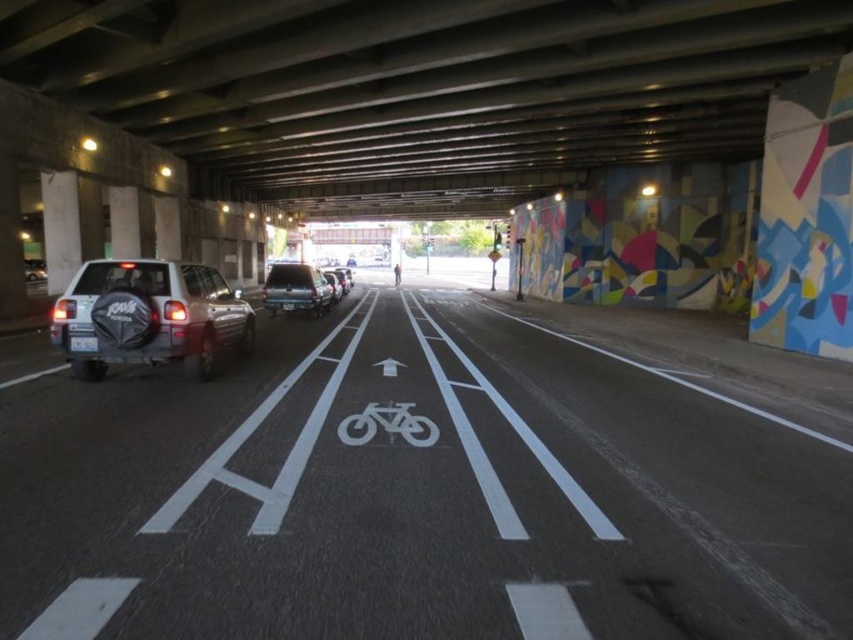
Does white painted lines at center have a smaller size compared to white plastic license plate at left?

No, white painted lines at center is not smaller than white plastic license plate at left.

The width and height of the screenshot is (853, 640). What are the coordinates of `white painted lines at center` in the screenshot? It's located at (434, 481).

The image size is (853, 640). Find the location of `white painted lines at center`. white painted lines at center is located at coordinates (434, 481).

Who is positioned more to the left, white painted lines at center or satin silver suv at center?

satin silver suv at center

Is white painted lines at center behind satin silver suv at center?

No, it is not.

This screenshot has height=640, width=853. Find the location of `white painted lines at center`. white painted lines at center is located at coordinates (434, 481).

Can you confirm if satin silver suv at center is positioned above white plastic license plate at center?

Yes.

Who is positioned more to the left, satin silver suv at center or white plastic license plate at center?

satin silver suv at center

In order to click on satin silver suv at center in this screenshot , I will do `click(296, 289)`.

Where is `satin silver suv at center`? satin silver suv at center is located at coordinates (296, 289).